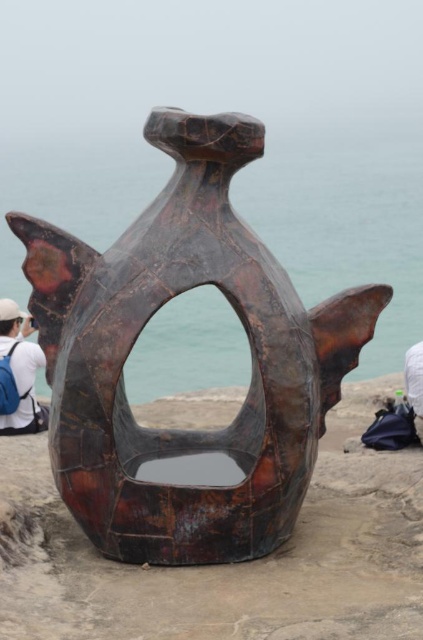
Based on the photo, you are an art student analyzing the sculpture. You notice two main components in the image. Which object is larger between the rusty metal fish at center and the rusty metal sculpture at center?

The rusty metal fish at center is bigger than the rusty metal sculpture at center according to the description.

You are an art student analyzing the sculpture. You notice two parts of the sculpture labeled as the rusty metal fish at center and the rusty metal sculpture at center. Which part is located to the right of the other?

The rusty metal fish at center is positioned on the right side of the rusty metal sculpture at center.

You are an art student analyzing the sculpture. You see the rusty metal fish at center and the rusty metal sculpture at center. Which one is closer to you?

The rusty metal fish at center is closer to you because the rusty metal sculpture at center is behind it.